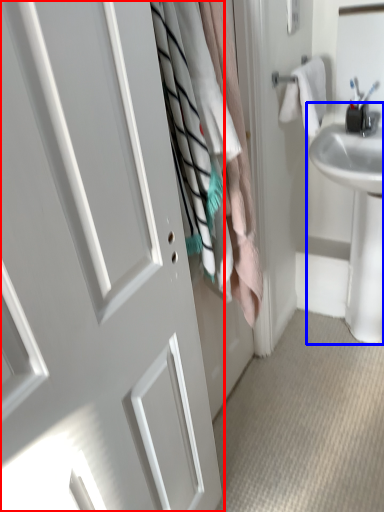
Question: Which object appears closest to the camera in this image, door (highlighted by a red box) or sink (highlighted by a blue box)?

Choices:
 (A) door
 (B) sink

Answer: (A)